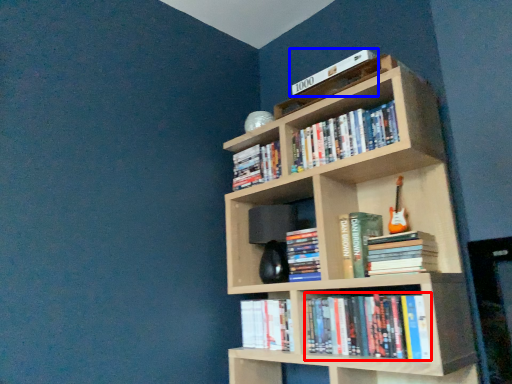
Question: Among these objects, which one is farthest to the camera, book (highlighted by a red box) or book (highlighted by a blue box)?

Choices:
 (A) book
 (B) book

Answer: (B)